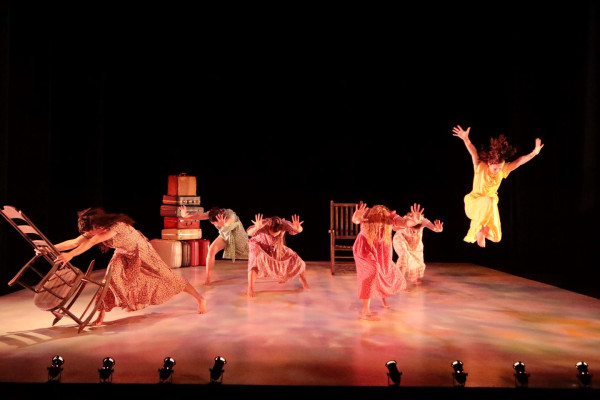
This screenshot has width=600, height=400. I want to click on chair, so click(346, 238).